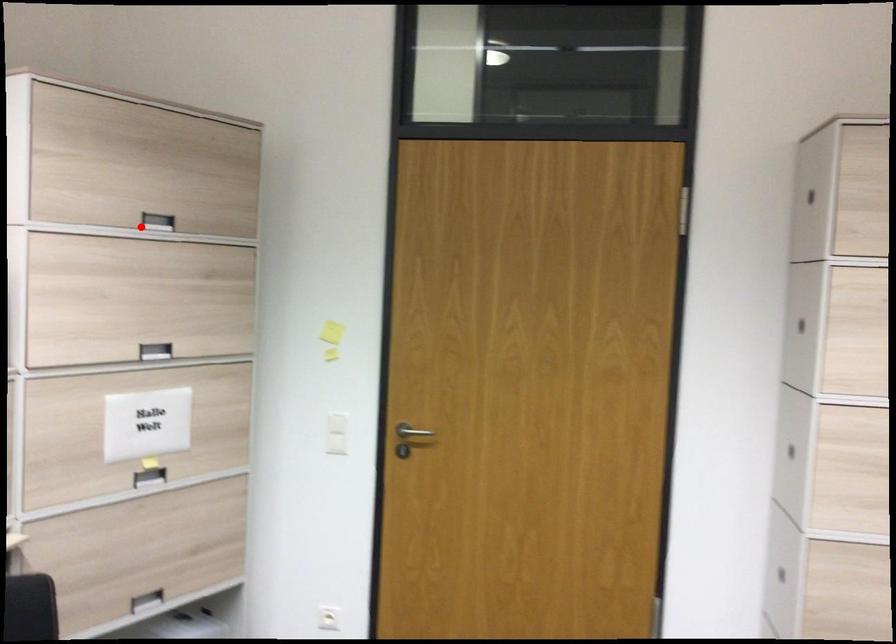
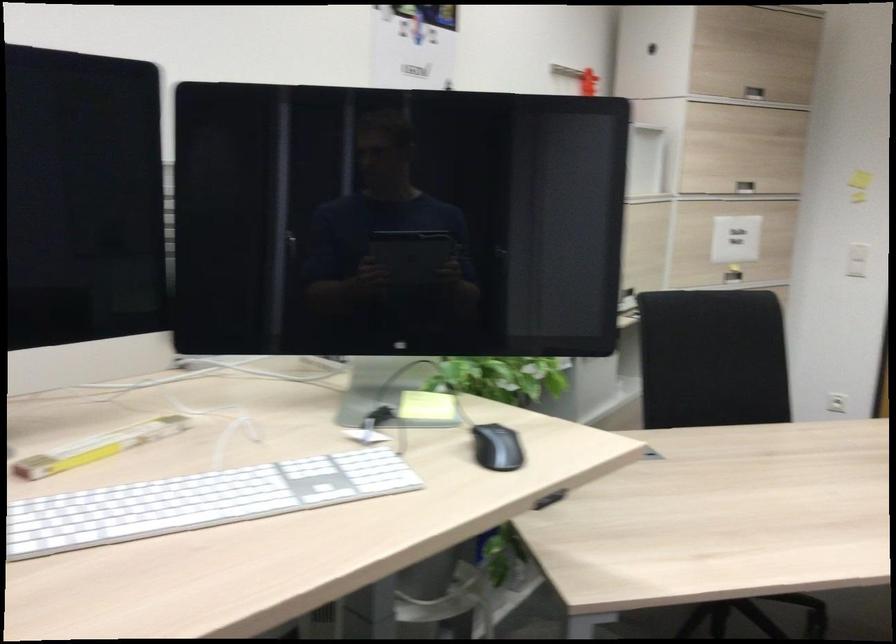
Question: I am providing you with two images of the same scene from different viewpoints. A red point is shown in image1. For the corresponding object point in image2, is it positioned nearer or farther from the camera?

Choices:
 (A) Nearer
 (B) Farther

Answer: (B)